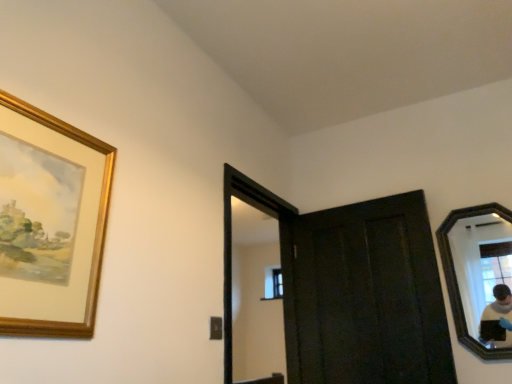
Question: From a real-world perspective, is dark wood door at center physically located above or below gold-framed painting at upper left?

Choices:
 (A) above
 (B) below

Answer: (B)

Question: Is dark wood door at center inside or outside of gold-framed painting at upper left?

Choices:
 (A) outside
 (B) inside

Answer: (A)

Question: Considering the real-world distances, which object is farthest from the gold-framed painting at upper left?

Choices:
 (A) black wooden mirror at right
 (B) dark wood door at center
 (C) clear glass window at center

Answer: (C)

Question: Which of these objects is positioned closest to the clear glass window at center?

Choices:
 (A) black wooden mirror at right
 (B) gold-framed painting at upper left
 (C) dark wood door at center

Answer: (C)